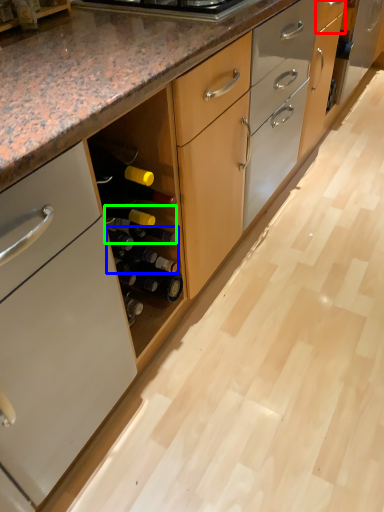
Question: Estimate the real-world distances between objects in this image. Which object is farther from drawer (highlighted by a red box), beer bottle (highlighted by a blue box) or wine bottle (highlighted by a green box)?

Choices:
 (A) beer bottle
 (B) wine bottle

Answer: (A)